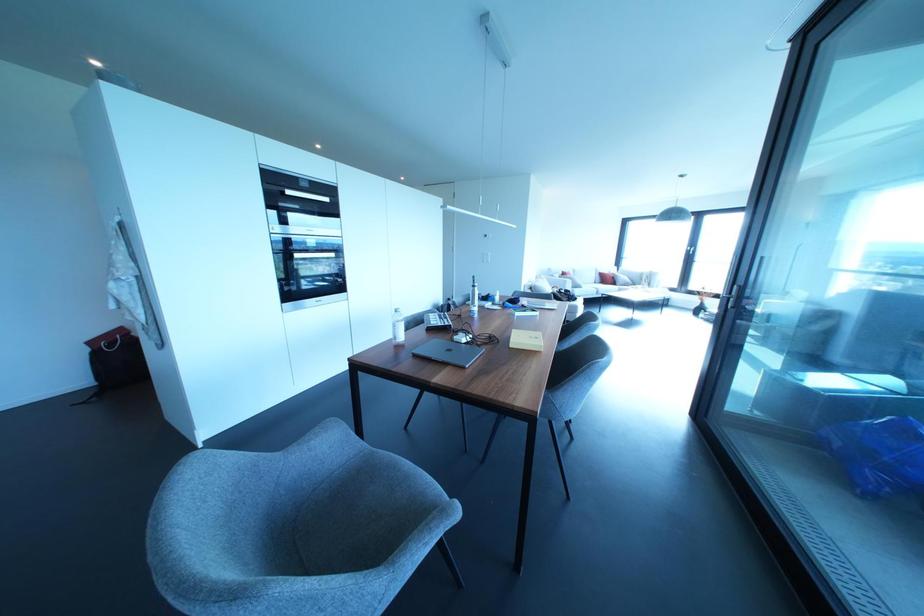
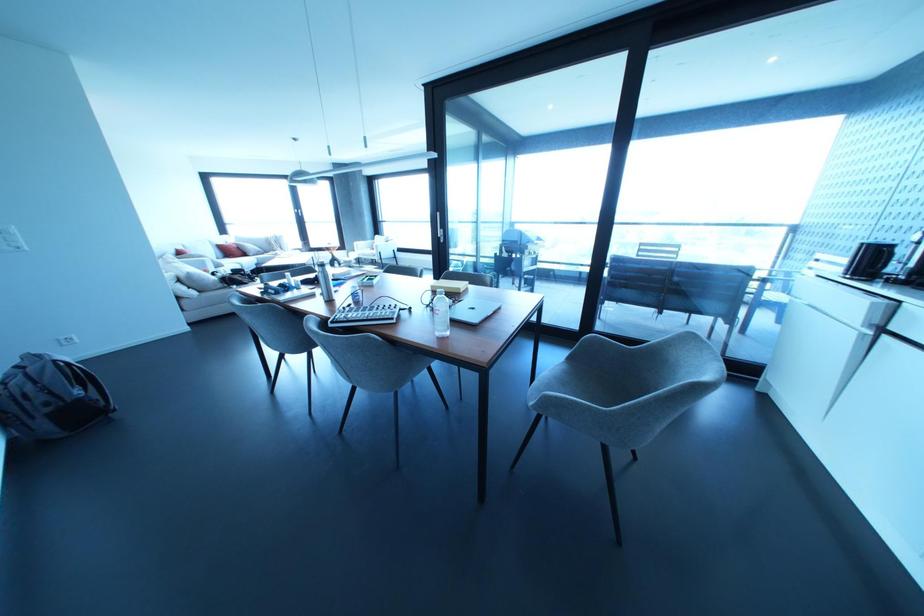
Where in the second image is the point corresponding to point 622,277 from the first image?

(249, 246)